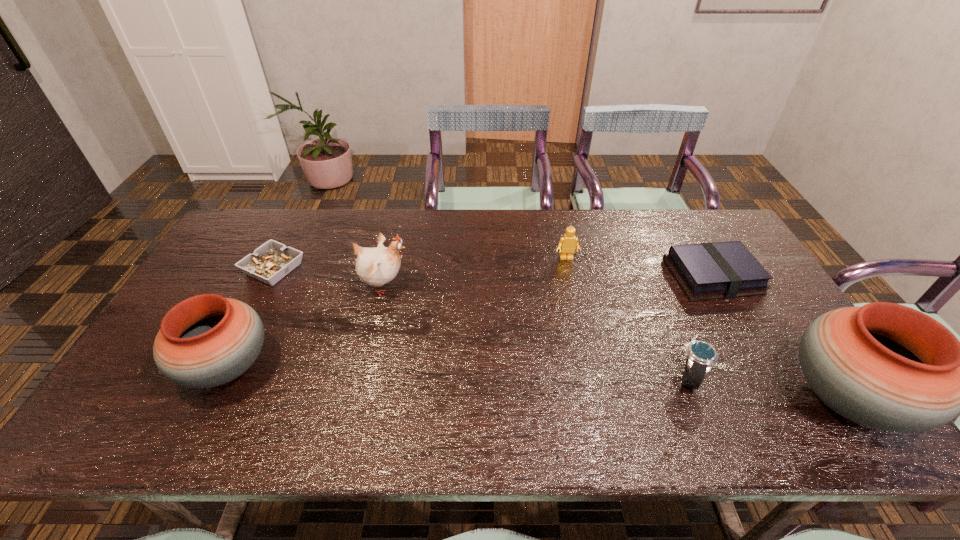
Where is `object that can be found as the third closest to the book`? The image size is (960, 540). object that can be found as the third closest to the book is located at coordinates (568, 243).

Image resolution: width=960 pixels, height=540 pixels. Identify the location of blank space that satisfies the following two spatial constraints: 1. on the face of the third shortest object; 2. on the left side of the Lego. (592, 376).

Where is `free location that satisfies the following two spatial constraints: 1. at the beak of the bird; 2. on the left side of the tallest object`? free location that satisfies the following two spatial constraints: 1. at the beak of the bird; 2. on the left side of the tallest object is located at coordinates (358, 399).

I want to click on vacant point that satisfies the following two spatial constraints: 1. on the front side of the taller pottery; 2. on the left side of the fifth tallest object, so click(699, 399).

At what (x,y) coordinates should I click in order to perform the action: click on blank area in the image that satisfies the following two spatial constraints: 1. at the beak of the fifth object from left to right; 2. on the right side of the bird. Please return your answer as a coordinate pair (x, y). The image size is (960, 540). Looking at the image, I should click on (363, 376).

Find the location of a particular element. This screenshot has height=540, width=960. free spot that satisfies the following two spatial constraints: 1. on the face of the fourth object from left to right; 2. on the left side of the fifth object from left to right is located at coordinates (592, 376).